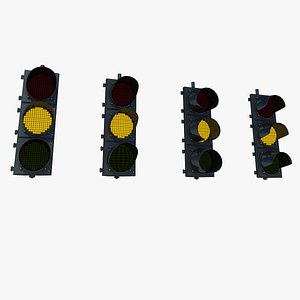
This screenshot has width=300, height=300. In order to click on light3 in this screenshot , I will do `click(205, 121)`.